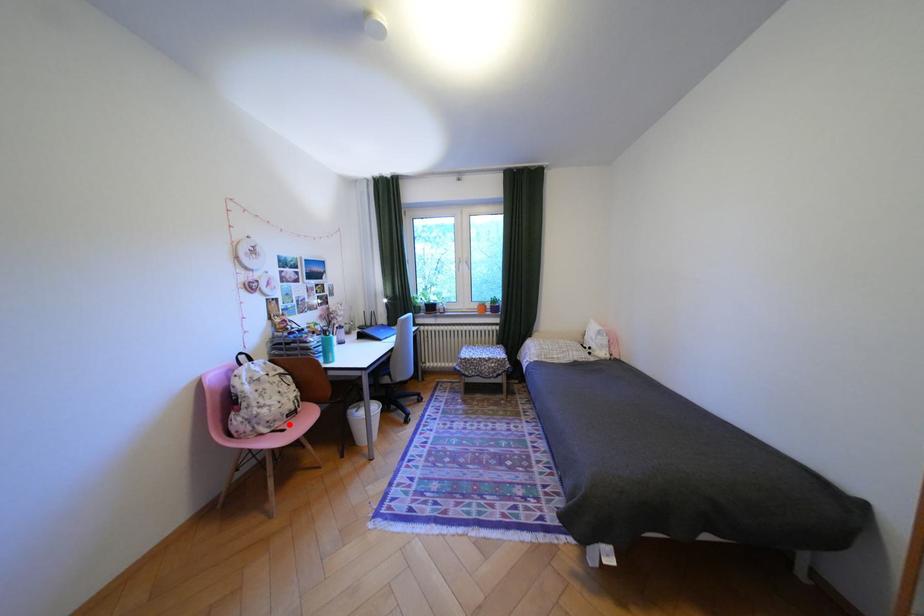
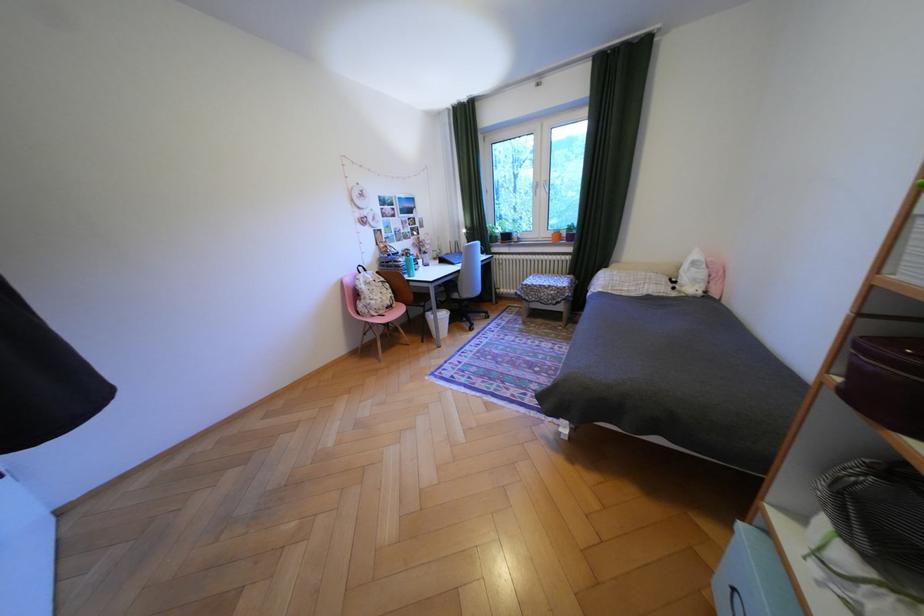
Find the pixel in the second image that matches the highlighted location in the first image.

(393, 312)